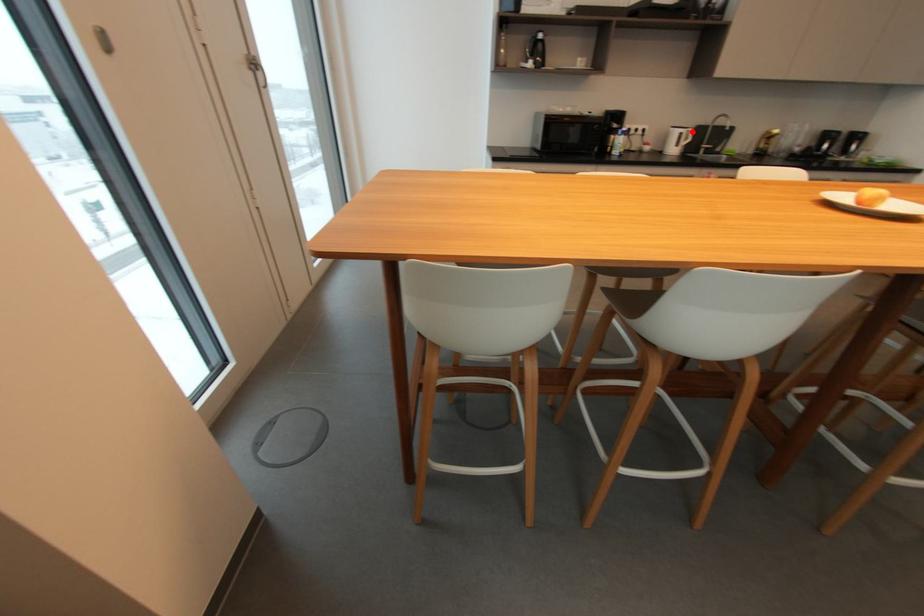
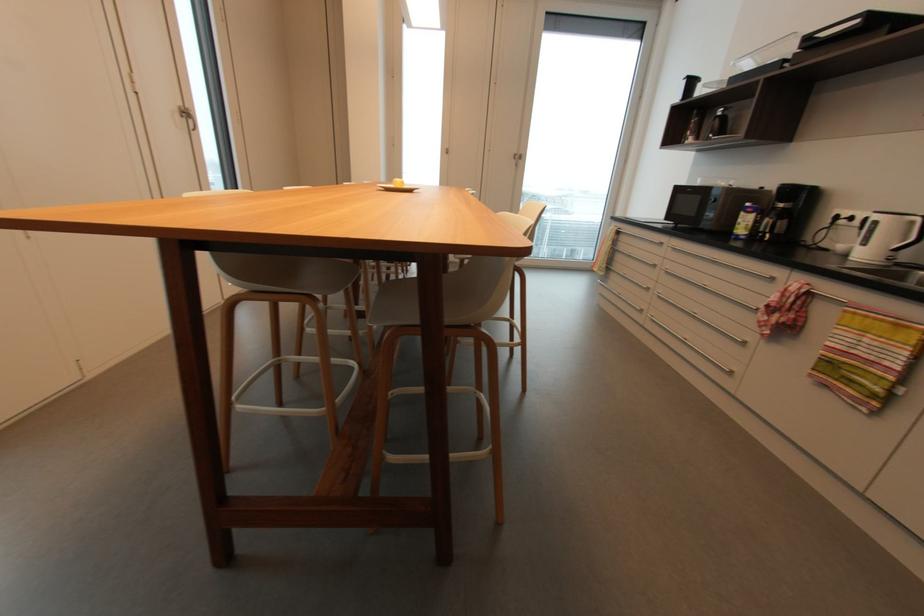
Question: I am providing you with two images of the same scene from different viewpoints. In image1, a red point is highlighted. Considering the same 3D point in image2, which of the following is correct?

Choices:
 (A) It is closer
 (B) It is farther

Answer: (B)